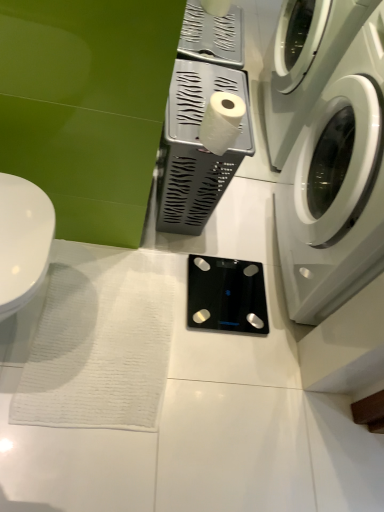
Question: Would you consider white glossy washing machine at right to be distant from white matte toilet paper at center?

Choices:
 (A) yes
 (B) no

Answer: (B)

Question: Can you confirm if white glossy washing machine at right is wider than white matte toilet paper at center?

Choices:
 (A) no
 (B) yes

Answer: (B)

Question: Is the position of white glossy washing machine at right more distant than that of white matte toilet paper at center?

Choices:
 (A) no
 (B) yes

Answer: (A)

Question: From a real-world perspective, is white glossy washing machine at right located higher than white matte toilet paper at center?

Choices:
 (A) no
 (B) yes

Answer: (A)

Question: Is the depth of white glossy washing machine at right less than that of white matte toilet paper at center?

Choices:
 (A) yes
 (B) no

Answer: (A)

Question: From the image's perspective, would you say white glossy washing machine at right is shown under white matte toilet paper at center?

Choices:
 (A) yes
 (B) no

Answer: (A)

Question: Is white glossy toilet at left to the left of black glass scale at center, acting as the 2th appliance starting from the top, from the viewer's perspective?

Choices:
 (A) yes
 (B) no

Answer: (A)

Question: Are white glossy toilet at left and black glass scale at center, which is the first appliance in bottom-to-top order, making contact?

Choices:
 (A) yes
 (B) no

Answer: (B)

Question: Does white glossy toilet at left have a lesser height compared to black glass scale at center, which is the first appliance in bottom-to-top order?

Choices:
 (A) no
 (B) yes

Answer: (A)

Question: From a real-world perspective, is white glossy toilet at left physically below black glass scale at center, which is the first appliance in bottom-to-top order?

Choices:
 (A) yes
 (B) no

Answer: (B)

Question: Is white glossy toilet at left taller than black glass scale at center, acting as the 2th appliance starting from the top?

Choices:
 (A) no
 (B) yes

Answer: (B)

Question: Is white glossy toilet at left positioned with its back to black glass scale at center, which is the first appliance in bottom-to-top order?

Choices:
 (A) yes
 (B) no

Answer: (B)

Question: Does white matte toilet paper at center appear on the right side of black glass scale at center, acting as the 2th appliance starting from the top?

Choices:
 (A) no
 (B) yes

Answer: (A)